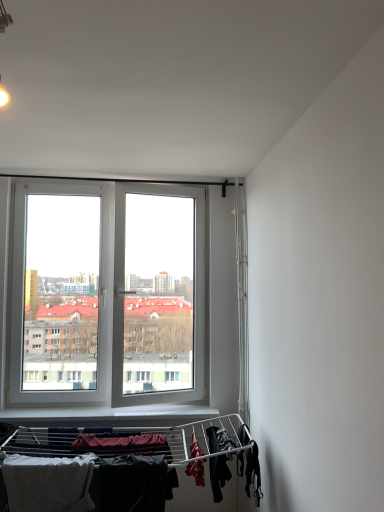
Question: Considering the positions of black fabric at lower right, placed as the third clothing when sorted from left to right, and gray cotton towel at lower left, the 3th clothing from the right, in the image, is black fabric at lower right, placed as the third clothing when sorted from left to right, taller or shorter than gray cotton towel at lower left, the 3th clothing from the right,?

Choices:
 (A) tall
 (B) short

Answer: (B)

Question: From a real-world perspective, is black fabric at lower right, which ranks as the 1th clothing in right-to-left order, above or below gray cotton towel at lower left, arranged as the first clothing when viewed from the left?

Choices:
 (A) above
 (B) below

Answer: (A)

Question: Which is nearer to the black fabric at lower right, which ranks as the 1th clothing in right-to-left order?

Choices:
 (A) dark matte fabric at lower center, the 2th clothing when ordered from right to left
 (B) gray cotton towel at lower left, arranged as the first clothing when viewed from the left

Answer: (A)

Question: Which object is the farthest from the black fabric at lower right, placed as the third clothing when sorted from left to right?

Choices:
 (A) gray cotton towel at lower left, arranged as the first clothing when viewed from the left
 (B) dark matte fabric at lower center, the 2th clothing when ordered from right to left

Answer: (A)